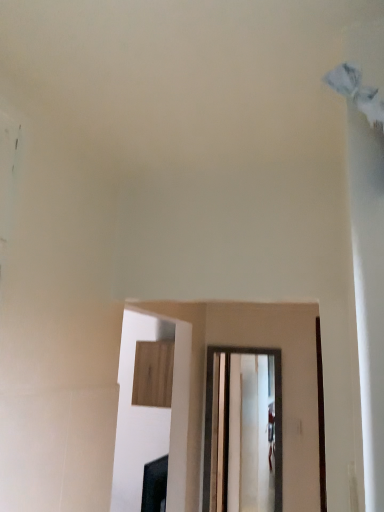
Describe the element at coordinates (211, 415) in the screenshot. I see `clear glass door at center` at that location.

This screenshot has height=512, width=384. I want to click on clear glass door at center, so click(211, 415).

What is the approximate width of wooden cabinet at upper center?

32.00 centimeters.

I want to click on wooden cabinet at upper center, so [153, 373].

What do you see at coordinates (153, 373) in the screenshot? This screenshot has width=384, height=512. I see `wooden cabinet at upper center` at bounding box center [153, 373].

Where is `clear glass door at center`? This screenshot has height=512, width=384. clear glass door at center is located at coordinates (211, 415).

Which object is positioned more to the left, wooden cabinet at upper center or clear glass door at center?

wooden cabinet at upper center is more to the left.

In the scene shown: Between wooden cabinet at upper center and clear glass door at center, which one is positioned behind?

wooden cabinet at upper center.

Which is nearer, (x=161, y=384) or (x=209, y=457)?

Point (x=161, y=384).

From the image's perspective, is wooden cabinet at upper center positioned above or below clear glass door at center?

wooden cabinet at upper center is above clear glass door at center.

From a real-world perspective, between wooden cabinet at upper center and clear glass door at center, who is vertically lower?

clear glass door at center, from a real-world perspective.

Can you confirm if wooden cabinet at upper center is wider than clear glass door at center?

Yes, wooden cabinet at upper center is wider than clear glass door at center.

Can you confirm if wooden cabinet at upper center is taller than clear glass door at center?

Incorrect, the height of wooden cabinet at upper center is not larger of that of clear glass door at center.

Considering the sizes of objects wooden cabinet at upper center and clear glass door at center in the image provided, who is smaller, wooden cabinet at upper center or clear glass door at center?

clear glass door at center is smaller.

Can we say wooden cabinet at upper center lies outside clear glass door at center?

wooden cabinet at upper center is positioned outside clear glass door at center.

Is there a large distance between wooden cabinet at upper center and clear glass door at center?

No, wooden cabinet at upper center is in close proximity to clear glass door at center.

Based on the photo, is clear glass door at center at the back of wooden cabinet at upper center?

Yes, wooden cabinet at upper center is positioned with its back facing clear glass door at center.

From the picture: How much distance is there between wooden cabinet at upper center and clear glass door at center?

16.09 inches.

This screenshot has width=384, height=512. What are the coordinates of `cabinetry that is on the left side of clear glass door at center` in the screenshot? It's located at tap(153, 373).

In the image, is clear glass door at center on the left side or the right side of wooden cabinet at upper center?

In the image, clear glass door at center appears on the right side of wooden cabinet at upper center.

Relative to wooden cabinet at upper center, is clear glass door at center in front or behind?

clear glass door at center is positioned closer to the viewer than wooden cabinet at upper center.

Is point (207, 440) behind point (166, 373)?

No, (207, 440) is closer to viewer.

From the image's perspective, is clear glass door at center below wooden cabinet at upper center?

Indeed, from the image's perspective, clear glass door at center is shown beneath wooden cabinet at upper center.

From a real-world perspective, is clear glass door at center physically located above or below wooden cabinet at upper center?

clear glass door at center is situated lower than wooden cabinet at upper center in the real world.

Which object is thinner, clear glass door at center or wooden cabinet at upper center?

clear glass door at center.

Does clear glass door at center have a lesser height compared to wooden cabinet at upper center?

Incorrect, the height of clear glass door at center does not fall short of that of wooden cabinet at upper center.

Can you confirm if clear glass door at center is bigger than wooden cabinet at upper center?

No, clear glass door at center is not bigger than wooden cabinet at upper center.

Looking at this image, would you say clear glass door at center is outside wooden cabinet at upper center?

clear glass door at center lies outside wooden cabinet at upper center's area.

Is clear glass door at center not close to wooden cabinet at upper center?

No, clear glass door at center is in close proximity to wooden cabinet at upper center.

Is clear glass door at center oriented towards wooden cabinet at upper center?

No.

Find the location of `cabinetry located on the left of clear glass door at center`. cabinetry located on the left of clear glass door at center is located at coordinates (153, 373).

Where is `window below the wooden cabinet at upper center (from a real-world perspective)`? window below the wooden cabinet at upper center (from a real-world perspective) is located at coordinates (211, 415).

There is a clear glass door at center. Where is `cabinetry above it (from a real-world perspective)`? cabinetry above it (from a real-world perspective) is located at coordinates (153, 373).